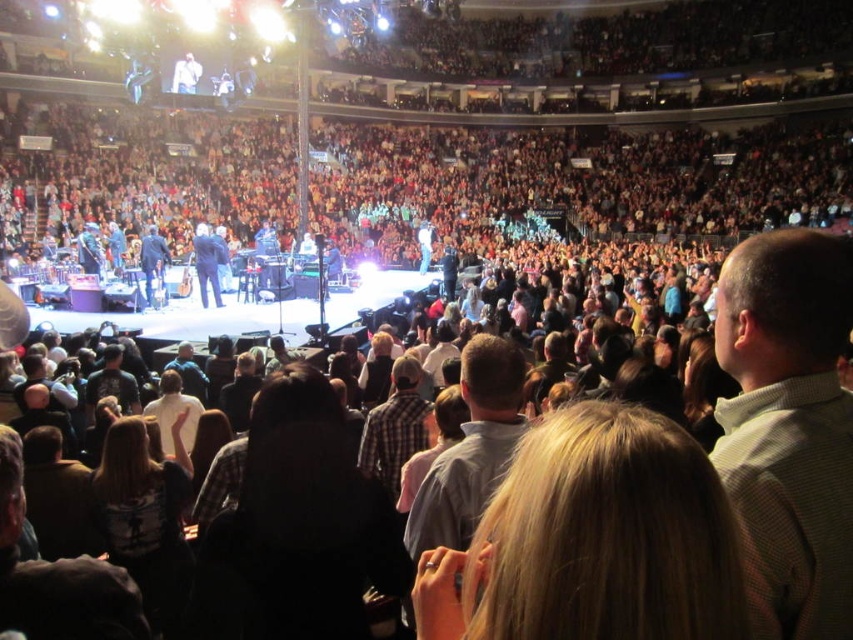
You are a photographer at the concert. You want to capture a photo of the performer with both the blonde hair at center and the light brown checkered shirt at center in the frame. Which object should you focus on first to ensure both are in focus?

The blonde hair at center is shorter than the light brown checkered shirt at center. To ensure both are in focus, you should focus on the light brown checkered shirt at center first since it is farther away.

You are a photographer at the concert. You want to take a photo that includes both the blonde hair at center and the white cotton shirt at center. Which object should you focus on first to ensure both are in the frame?

The blonde hair at center is larger in size than the white cotton shirt at center, so you should focus on the blonde hair at center first to ensure both are in the frame.